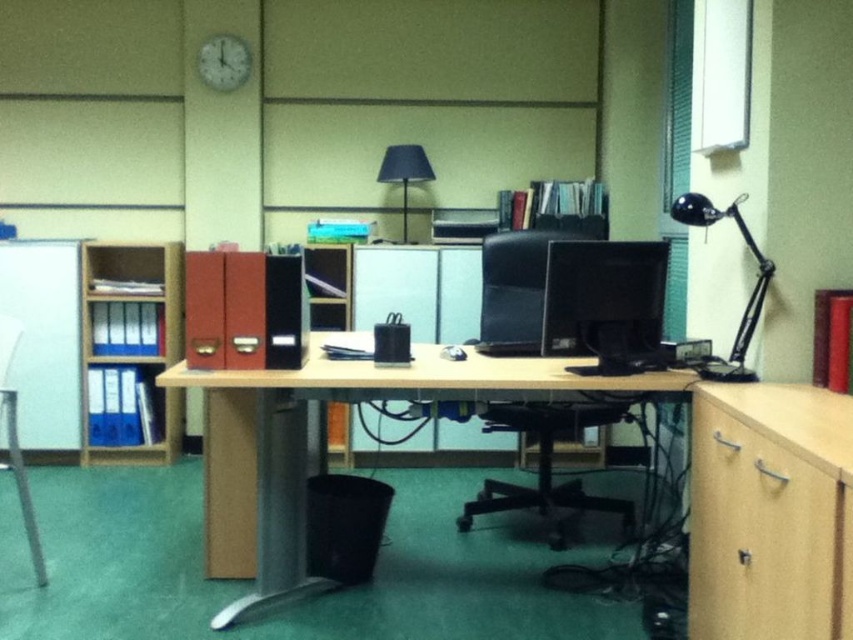
Does wooden desk at center have a lesser width compared to matte black lamp at upper center?

In fact, wooden desk at center might be wider than matte black lamp at upper center.

Which of these two, wooden desk at center or matte black lamp at upper center, stands shorter?

matte black lamp at upper center

Is point (258, 416) positioned after point (380, 163)?

No, (258, 416) is in front of (380, 163).

In order to click on wooden desk at center in this screenshot , I will do `click(306, 442)`.

Who is higher up, wooden shelves at left or matte black monitor at center?

Positioned higher is matte black monitor at center.

Does wooden shelves at left have a smaller size compared to matte black monitor at center?

Actually, wooden shelves at left might be larger than matte black monitor at center.

Is point (161, 289) farther from camera compared to point (601, 346)?

Yes, it is behind point (601, 346).

At what (x,y) coordinates should I click in order to perform the action: click on wooden shelves at left. Please return your answer as a coordinate pair (x, y). Image resolution: width=853 pixels, height=640 pixels. Looking at the image, I should click on (131, 349).

Who is positioned more to the left, wooden shelves at left or white plastic clock at upper center?

From the viewer's perspective, wooden shelves at left appears more on the left side.

Who is more distant from viewer, (169,336) or (231,61)?

Point (231,61)

Image resolution: width=853 pixels, height=640 pixels. What do you see at coordinates (131, 349) in the screenshot?
I see `wooden shelves at left` at bounding box center [131, 349].

Locate an element on the screen. The width and height of the screenshot is (853, 640). wooden shelves at left is located at coordinates (131, 349).